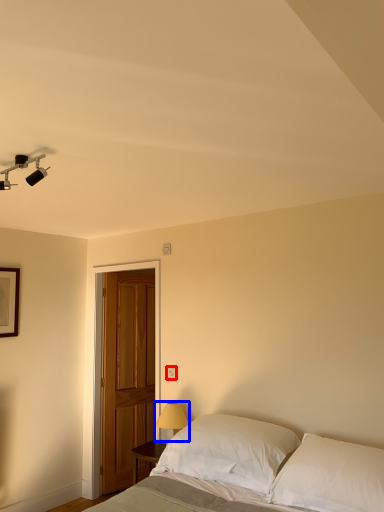
Question: Which of the following is the closest to the observer, electric outlet (highlighted by a red box) or table lamp (highlighted by a blue box)?

Choices:
 (A) electric outlet
 (B) table lamp

Answer: (B)